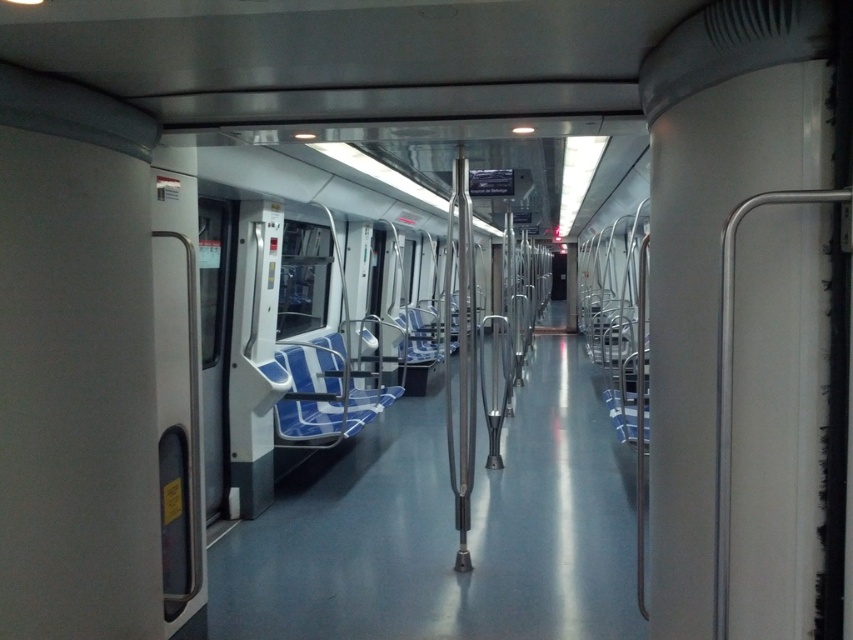
Does blue fabric chair at center come behind blue fabric seat at center?

No, it is not.

Who is taller, blue fabric chair at center or blue fabric seat at center?

blue fabric chair at center is taller.

Measure the distance between point (334,356) and camera.

Point (334,356) is 23.94 feet away from camera.

Find the location of `blue fabric chair at center`. blue fabric chair at center is located at coordinates (312, 403).